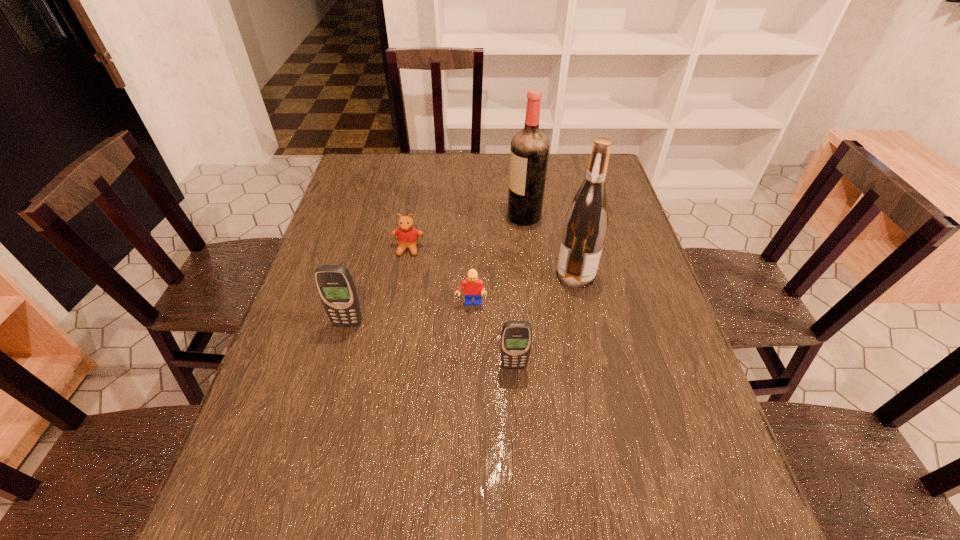
The width and height of the screenshot is (960, 540). Find the location of `free spot between the rightmost object and the Lego`. free spot between the rightmost object and the Lego is located at coordinates (523, 289).

Locate an element on the screen. The width and height of the screenshot is (960, 540). vacant region between the liquor and the right cellular telephone is located at coordinates (519, 292).

Where is `vacant area that lies between the right cellular telephone and the fourth farthest object`? This screenshot has height=540, width=960. vacant area that lies between the right cellular telephone and the fourth farthest object is located at coordinates pyautogui.click(x=492, y=335).

At what (x,y) coordinates should I click in order to perform the action: click on vacant space that's between the nearer cellular telephone and the farthest object. Please return your answer as a coordinate pair (x, y). Image resolution: width=960 pixels, height=540 pixels. Looking at the image, I should click on (519, 292).

This screenshot has width=960, height=540. Find the location of `blank region between the farther cellular telephone and the farthest object`. blank region between the farther cellular telephone and the farthest object is located at coordinates pos(436,270).

Locate an element on the screen. This screenshot has width=960, height=540. the third closest object to the Lego is located at coordinates (586, 222).

Where is `the second closest object relative to the farthest object`? This screenshot has height=540, width=960. the second closest object relative to the farthest object is located at coordinates (407, 236).

In order to click on vacant region that satisfies the following two spatial constraints: 1. on the front-facing side of the teddy bear; 2. on the left side of the wine bottle in this screenshot , I will do `click(404, 274)`.

This screenshot has width=960, height=540. What are the coordinates of `free region that satisfies the following two spatial constraints: 1. on the front-facing side of the farthest object; 2. on the front-facing side of the teddy bear` in the screenshot? It's located at (528, 249).